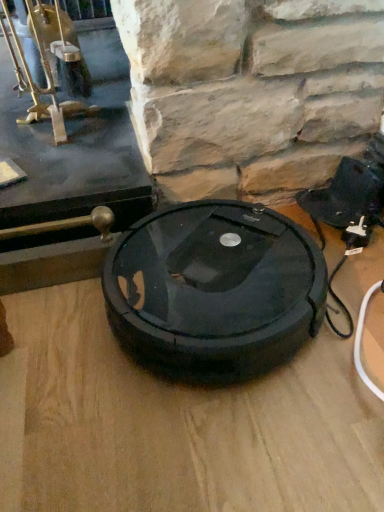
What do you see at coordinates (175, 424) in the screenshot? I see `black plastic table top at center` at bounding box center [175, 424].

Find the location of a particular element. The image size is (384, 512). black plastic table top at center is located at coordinates (175, 424).

What do you see at coordinates (215, 289) in the screenshot? I see `black rubber robot vacuum cleaner at center` at bounding box center [215, 289].

Identify the location of black rubber robot vacuum cleaner at center. (215, 289).

At what (x,y) coordinates should I click in order to perform the action: click on black plastic table top at center. Please return your answer as a coordinate pair (x, y). Image resolution: width=384 pixels, height=512 pixels. Looking at the image, I should click on (175, 424).

Does black rubber robot vacuum cleaner at center appear on the left side of black plastic table top at center?

In fact, black rubber robot vacuum cleaner at center is to the right of black plastic table top at center.

Is black rubber robot vacuum cleaner at center in front of black plastic table top at center?

No, black rubber robot vacuum cleaner at center is further to the viewer.

Which is behind, point (290, 330) or point (166, 470)?

The point (290, 330) is more distant.

From the image's perspective, is black rubber robot vacuum cleaner at center above or below black plastic table top at center?

black rubber robot vacuum cleaner at center is situated lower than black plastic table top at center in the image.

From a real-world perspective, is black rubber robot vacuum cleaner at center physically below black plastic table top at center?

No, from a real-world perspective, black rubber robot vacuum cleaner at center is not under black plastic table top at center.

Considering the sizes of objects black rubber robot vacuum cleaner at center and black plastic table top at center in the image provided, who is thinner, black rubber robot vacuum cleaner at center or black plastic table top at center?

black rubber robot vacuum cleaner at center.

Who is taller, black rubber robot vacuum cleaner at center or black plastic table top at center?

black rubber robot vacuum cleaner at center is taller.

Which of these two, black rubber robot vacuum cleaner at center or black plastic table top at center, is bigger?

black plastic table top at center.

Is black rubber robot vacuum cleaner at center outside of black plastic table top at center?

Yes, black rubber robot vacuum cleaner at center is not within black plastic table top at center.

Is black rubber robot vacuum cleaner at center positioned far away from black plastic table top at center?

black rubber robot vacuum cleaner at center is near black plastic table top at center, not far away.

Is black plastic table top at center at the back of black rubber robot vacuum cleaner at center?

No, black plastic table top at center is not at the back of black rubber robot vacuum cleaner at center.

Can you tell me how much black rubber robot vacuum cleaner at center and black plastic table top at center differ in facing direction?

The angle between the facing direction of black rubber robot vacuum cleaner at center and the facing direction of black plastic table top at center is 86.9 degrees.

Consider the image. Measure the distance from black rubber robot vacuum cleaner at center to black plastic table top at center.

A distance of 10.93 centimeters exists between black rubber robot vacuum cleaner at center and black plastic table top at center.

Find the location of a particular element. This screenshot has height=512, width=384. table top lying above the black rubber robot vacuum cleaner at center (from the image's perspective) is located at coordinates (175, 424).

Considering the positions of objects black plastic table top at center and black rubber robot vacuum cleaner at center in the image provided, who is more to the right, black plastic table top at center or black rubber robot vacuum cleaner at center?

black rubber robot vacuum cleaner at center.

Considering their positions, is black plastic table top at center located in front of or behind black rubber robot vacuum cleaner at center?

black plastic table top at center is in front of black rubber robot vacuum cleaner at center.

Does point (253, 449) appear closer or farther from the camera than point (202, 282)?

Point (253, 449) appears to be closer to the viewer than point (202, 282).

From the image's perspective, which is below, black plastic table top at center or black rubber robot vacuum cleaner at center?

black rubber robot vacuum cleaner at center.

In the scene shown: From a real-world perspective, is black plastic table top at center physically above black rubber robot vacuum cleaner at center?

Incorrect, from a real-world perspective, black plastic table top at center is lower than black rubber robot vacuum cleaner at center.

Which object is wider, black plastic table top at center or black rubber robot vacuum cleaner at center?

black plastic table top at center.

Considering the relative sizes of black plastic table top at center and black rubber robot vacuum cleaner at center in the image provided, is black plastic table top at center taller than black rubber robot vacuum cleaner at center?

No.

Is black plastic table top at center smaller than black rubber robot vacuum cleaner at center?

Actually, black plastic table top at center might be larger than black rubber robot vacuum cleaner at center.

Is black rubber robot vacuum cleaner at center located within black plastic table top at center?

No.

Is black plastic table top at center touching black rubber robot vacuum cleaner at center?

black plastic table top at center and black rubber robot vacuum cleaner at center are clearly separated.

Is black plastic table top at center aimed at black rubber robot vacuum cleaner at center?

No, black plastic table top at center is not turned towards black rubber robot vacuum cleaner at center.

How different are the orientations of black plastic table top at center and black rubber robot vacuum cleaner at center in degrees?

86.9 degrees separate the facing orientations of black plastic table top at center and black rubber robot vacuum cleaner at center.

Measure the distance from black plastic table top at center to black rubber robot vacuum cleaner at center.

A distance of 4.30 inches exists between black plastic table top at center and black rubber robot vacuum cleaner at center.

The image size is (384, 512). I want to click on table top above the black rubber robot vacuum cleaner at center (from the image's perspective), so click(175, 424).

Identify the location of car tire that appears above the black plastic table top at center (from a real-world perspective). The image size is (384, 512). (215, 289).

Where is `car tire on the right of black plastic table top at center`? car tire on the right of black plastic table top at center is located at coordinates (215, 289).